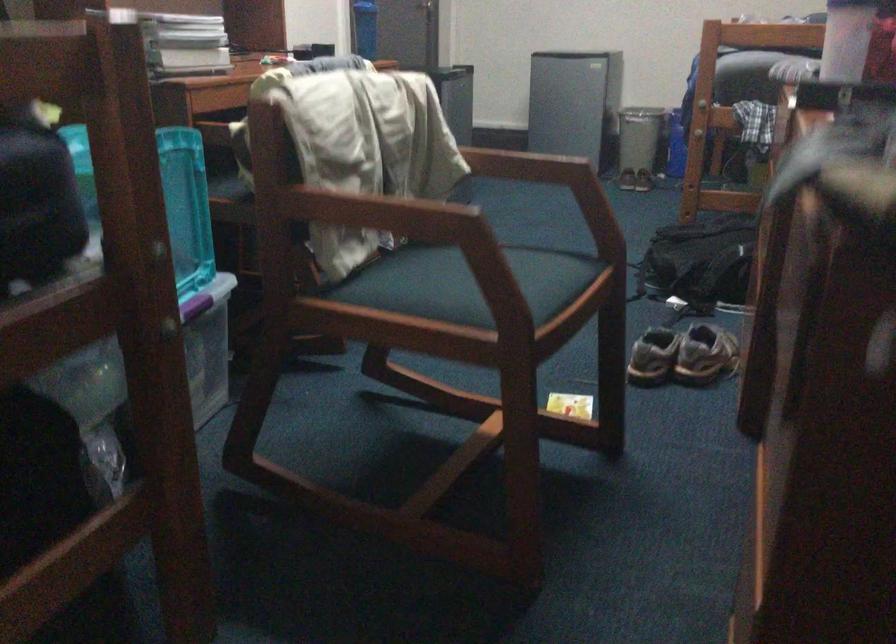
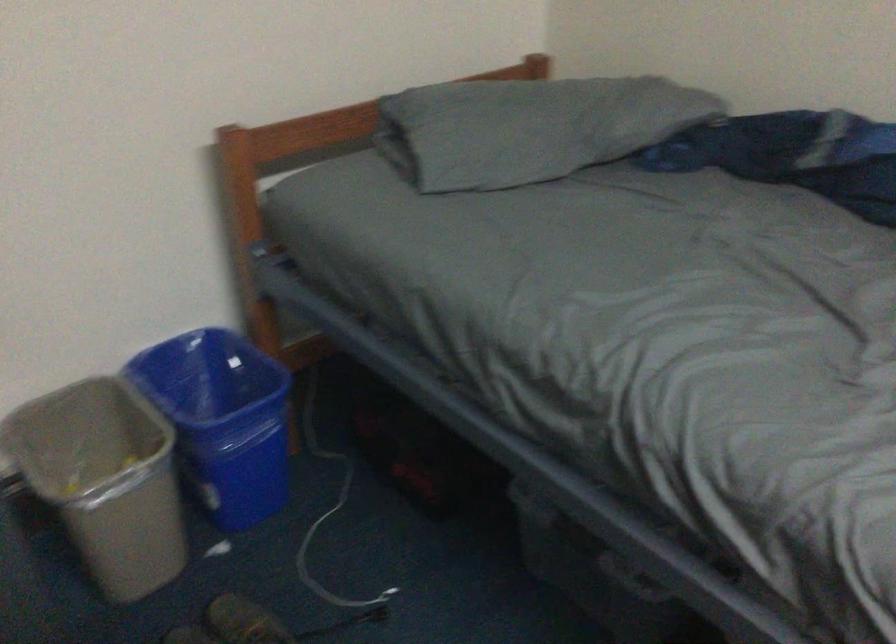
In the second image, find the point that corresponds to point (619, 79) in the first image.

(104, 480)